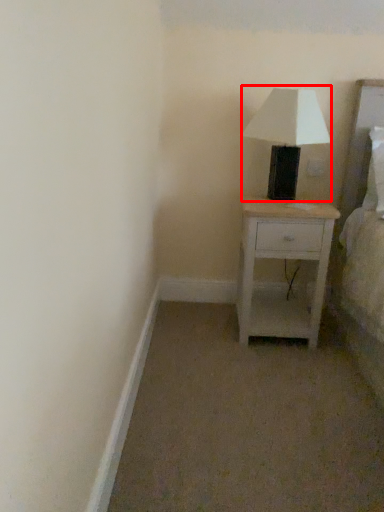
Question: From the image's perspective, what is the correct spatial relationship of table lamp (annotated by the red box) in relation to nightstand?

Choices:
 (A) below
 (B) above

Answer: (B)